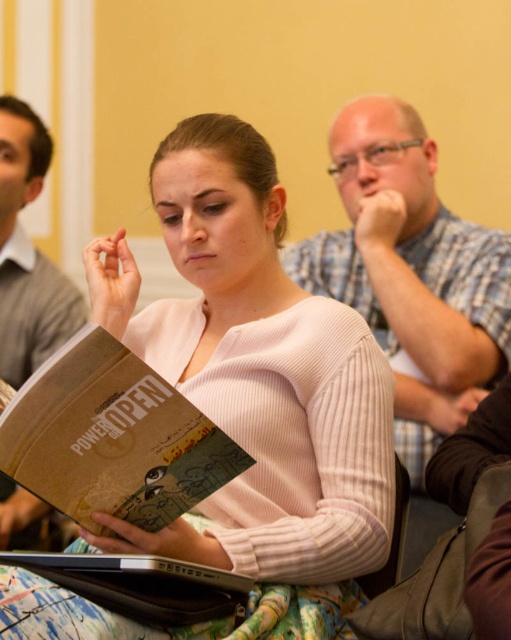
Question: Where is plaid shirt at upper right located in relation to brown fabric chair at lower right in the image?

Choices:
 (A) right
 (B) left

Answer: (A)

Question: Which point is closer to the camera?

Choices:
 (A) (328, 372)
 (B) (48, 280)
 (C) (123, 403)

Answer: (C)

Question: Based on their relative distances, which object is nearer to the plaid shirt at upper right?

Choices:
 (A) brown fabric chair at lower right
 (B) pink ribbed sweater at center

Answer: (B)

Question: Can you confirm if brown cardboard book at center is bigger than matte gray sweater at center?

Choices:
 (A) no
 (B) yes

Answer: (A)

Question: Considering the relative positions of pink ribbed sweater at center and brown fabric chair at lower right in the image provided, where is pink ribbed sweater at center located with respect to brown fabric chair at lower right?

Choices:
 (A) right
 (B) left

Answer: (B)

Question: Among these points, which one is farthest from the camera?

Choices:
 (A) (3, 316)
 (B) (475, 356)
 (C) (79, 337)
 (D) (398, 579)

Answer: (A)